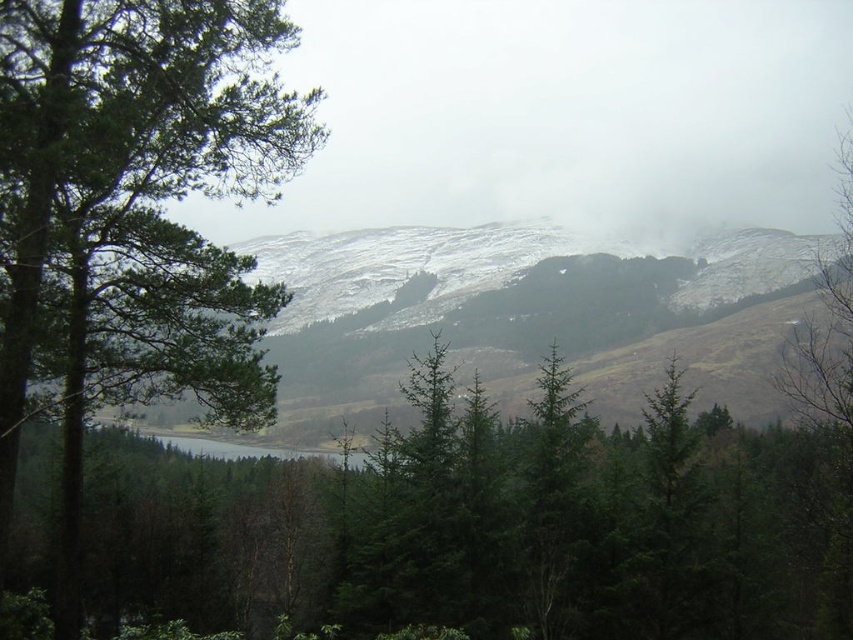
Consider the image. You are a hiker standing at the edge of the green matte forest at center. If you walk straight ahead, will you eventually reach the water? Please explain your reasoning based on the scene description.

Based on the scene description, the green matte forest at center is located at coordinates point (486, 528). The water is described as being in the midground beyond the forest. Since the forest is positioned centrally and the water is beyond it, walking straight ahead through the forest would lead towards the water.

You are an observer standing in the middle of the scene. You see the green matte forest at center and the green matte tree at left. Which one is located to the left?

The green matte tree at left is located to the left of the green matte forest at center.